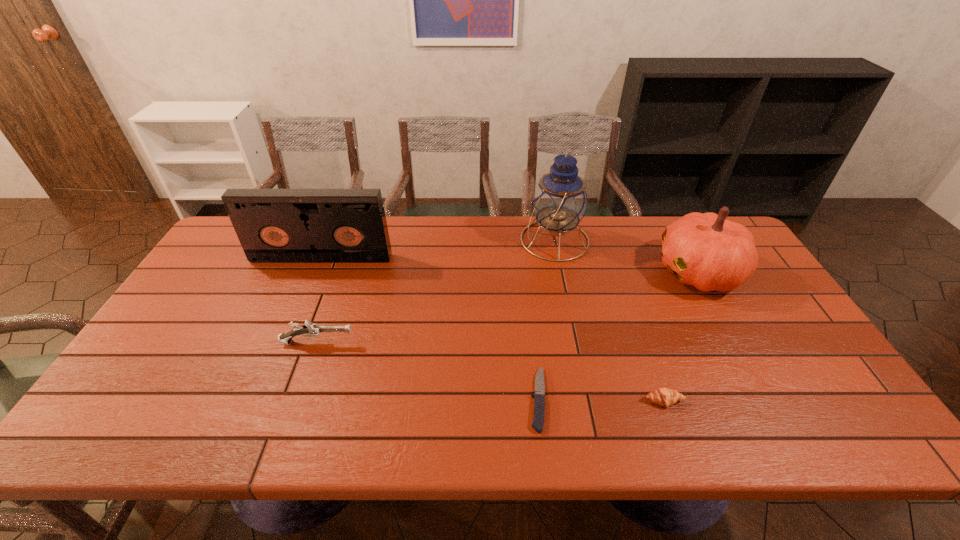
What are the coordinates of `free space between the videotape and the shortest object` in the screenshot? It's located at pyautogui.click(x=429, y=329).

Locate an element on the screen. The width and height of the screenshot is (960, 540). free space between the steak knife and the fourth tallest object is located at coordinates (427, 370).

This screenshot has width=960, height=540. I want to click on free space between the videotape and the tallest object, so click(438, 249).

Image resolution: width=960 pixels, height=540 pixels. In order to click on vacant space that's between the videotape and the fifth tallest object in this screenshot , I will do pyautogui.click(x=492, y=330).

The height and width of the screenshot is (540, 960). In order to click on free spot between the second object from right to left and the pumpkin in this screenshot , I will do `click(682, 336)`.

The height and width of the screenshot is (540, 960). Find the location of `free space between the lantern and the third shortest object`. free space between the lantern and the third shortest object is located at coordinates (436, 291).

Image resolution: width=960 pixels, height=540 pixels. I want to click on vacant area that lies between the third shortest object and the tallest object, so click(436, 291).

Where is `vacant space that's between the videotape and the lantern`? This screenshot has width=960, height=540. vacant space that's between the videotape and the lantern is located at coordinates (438, 249).

Image resolution: width=960 pixels, height=540 pixels. Identify the location of vacant area that lies between the fourth farthest object and the shortest object. (427, 370).

Identify the location of free area in between the pastry and the rightmost object. The height and width of the screenshot is (540, 960). (682, 336).